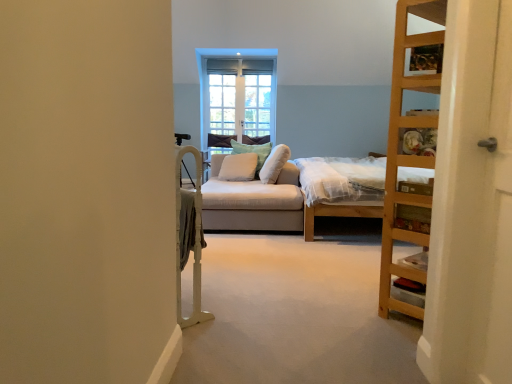
How much space does white soft cushion at center, arranged as the third pillow when viewed from the right, occupy horizontally?

It is 17.47 inches.

This screenshot has width=512, height=384. What do you see at coordinates (472, 203) in the screenshot?
I see `white wood screen door at right` at bounding box center [472, 203].

You are a GUI agent. You are given a task and a screenshot of the screen. Output one action in this format:
    pyautogui.click(x=<x>, y=<y>)
    Task: Click on the light beige fabric couch at center
    
    Given the screenshot: What is the action you would take?
    pyautogui.click(x=255, y=198)

From the picture: Measure the distance between point (388, 291) and camera.

Point (388, 291) is 2.29 meters from camera.

In order to click on light brown wooden bed at right in this screenshot , I will do `click(340, 190)`.

Considering the sizes of objects white soft pillow at center, which is the 3th pillow from left to right, and white wood screen door at right in the image provided, who is bigger, white soft pillow at center, which is the 3th pillow from left to right, or white wood screen door at right?

Bigger between the two is white soft pillow at center, which is the 3th pillow from left to right.

Is white soft pillow at center, which is the first pillow from right to left, situated inside white wood screen door at right or outside?

white soft pillow at center, which is the first pillow from right to left, is spatially situated outside white wood screen door at right.

This screenshot has width=512, height=384. Find the location of `screen door in front of the white soft pillow at center, which is the 3th pillow from left to right`. screen door in front of the white soft pillow at center, which is the 3th pillow from left to right is located at coordinates (472, 203).

From the image's perspective, is white soft pillow at center, which is the first pillow from right to left, above or below white wood screen door at right?

Based on their image positions, white soft pillow at center, which is the first pillow from right to left, is located above white wood screen door at right.

Who is smaller, light brown wooden bed at right or white soft pillow at center, which is the first pillow from right to left?

white soft pillow at center, which is the first pillow from right to left, is smaller.

Which is in front, point (358, 159) or point (273, 155)?

Positioned in front is point (273, 155).

Is the position of light brown wooden bed at right less distant than that of white soft pillow at center, which is the 3th pillow from left to right?

That is True.

This screenshot has height=384, width=512. Find the location of `pillow that is the 3rd one above the light brown wooden bed at right (from a real-world perspective)`. pillow that is the 3rd one above the light brown wooden bed at right (from a real-world perspective) is located at coordinates (274, 164).

Are white soft pillow at center, which ranks as the 2th pillow in right-to-left order, and white wood screen door at right beside each other?

There is a gap between white soft pillow at center, which ranks as the 2th pillow in right-to-left order, and white wood screen door at right.

From the picture: Who is bigger, white soft pillow at center, placed as the 2th pillow when sorted from left to right, or white wood screen door at right?

white soft pillow at center, placed as the 2th pillow when sorted from left to right.

From the image's perspective, who appears lower, white soft pillow at center, which ranks as the 2th pillow in right-to-left order, or white wood screen door at right?

white wood screen door at right appears lower in the image.

Is white soft pillow at center, placed as the 2th pillow when sorted from left to right, wider than white wood screen door at right?

Correct, the width of white soft pillow at center, placed as the 2th pillow when sorted from left to right, exceeds that of white wood screen door at right.

Based on their positions, is white wood screen door at right located to the left or right of white soft pillow at center, which ranks as the 2th pillow in right-to-left order?

Clearly, white wood screen door at right is on the right of white soft pillow at center, which ranks as the 2th pillow in right-to-left order, in the image.

Is white wood screen door at right placed right next to white soft pillow at center, which ranks as the 2th pillow in right-to-left order?

They are not placed beside each other.

Is point (451, 244) more distant than point (259, 154)?

No.

Can you confirm if white wood screen door at right is wider than white soft pillow at center, which ranks as the 2th pillow in right-to-left order?

In fact, white wood screen door at right might be narrower than white soft pillow at center, which ranks as the 2th pillow in right-to-left order.

Which is correct: clear glass window at center is inside white soft pillow at center, placed as the 2th pillow when sorted from left to right, or outside of it?

clear glass window at center is not inside white soft pillow at center, placed as the 2th pillow when sorted from left to right, it's outside.

At what (x,y) coordinates should I click in order to perform the action: click on window above the white soft pillow at center, placed as the 2th pillow when sorted from left to right (from the image's perspective). Please return your answer as a coordinate pair (x, y). This screenshot has height=384, width=512. Looking at the image, I should click on (237, 94).

Considering the sizes of clear glass window at center and white soft pillow at center, which ranks as the 2th pillow in right-to-left order, in the image, is clear glass window at center bigger or smaller than white soft pillow at center, which ranks as the 2th pillow in right-to-left order,?

clear glass window at center is smaller than white soft pillow at center, which ranks as the 2th pillow in right-to-left order.

Is clear glass window at center oriented towards white soft pillow at center, placed as the 2th pillow when sorted from left to right?

Yes.

The image size is (512, 384). What are the coordinates of `screen door below the light beige fabric couch at center (from the image's perspective)` in the screenshot? It's located at 472,203.

Which object is closer to the camera, light beige fabric couch at center or white wood screen door at right?

Positioned in front is white wood screen door at right.

Is light beige fabric couch at center located outside white wood screen door at right?

Yes, light beige fabric couch at center is not within white wood screen door at right.

Based on the photo, does light beige fabric couch at center have a lesser width compared to white wood screen door at right?

Incorrect, the width of light beige fabric couch at center is not less than that of white wood screen door at right.

Can you confirm if white soft pillow at center, which is the 3th pillow from left to right, is wider than white soft cushion at center, arranged as the third pillow when viewed from the right?

Incorrect, the width of white soft pillow at center, which is the 3th pillow from left to right, does not surpass that of white soft cushion at center, arranged as the third pillow when viewed from the right.

Which of these two, white soft pillow at center, which is the 3th pillow from left to right, or white soft cushion at center, arranged as the third pillow when viewed from the right, stands shorter?

white soft pillow at center, which is the 3th pillow from left to right.

Is point (280, 150) closer or farther from the camera than point (255, 160)?

Point (280, 150) is positioned closer to the camera compared to point (255, 160).

Could you tell me if white soft pillow at center, which is the 3th pillow from left to right, is turned towards white soft cushion at center, marked as the 1th pillow in a left-to-right arrangement?

Yes, white soft pillow at center, which is the 3th pillow from left to right, faces towards white soft cushion at center, marked as the 1th pillow in a left-to-right arrangement.

Where is `screen door that is in front of the white soft pillow at center, which is the 3th pillow from left to right`? The height and width of the screenshot is (384, 512). screen door that is in front of the white soft pillow at center, which is the 3th pillow from left to right is located at coordinates (472, 203).

This screenshot has height=384, width=512. What are the coordinates of `the 1st pillow counting from the left side of the light brown wooden bed at right` in the screenshot? It's located at (274, 164).

Considering their positions, is white soft pillow at center, placed as the 2th pillow when sorted from left to right, positioned closer to white soft pillow at center, which is the 3th pillow from left to right, than clear glass window at center?

white soft pillow at center, placed as the 2th pillow when sorted from left to right, is positioned closer to the anchor white soft pillow at center, which is the 3th pillow from left to right.

Based on their spatial positions, is white soft pillow at center, placed as the 2th pillow when sorted from left to right, or clear glass window at center further from white soft cushion at center, marked as the 1th pillow in a left-to-right arrangement?

The object further to white soft cushion at center, marked as the 1th pillow in a left-to-right arrangement, is clear glass window at center.

Estimate the real-world distances between objects in this image. Which object is further from light brown wooden bed at right, white soft pillow at center, which is the 3th pillow from left to right, or white wood screen door at right?

The object further to light brown wooden bed at right is white wood screen door at right.

Estimate the real-world distances between objects in this image. Which object is closer to white soft cushion at center, marked as the 1th pillow in a left-to-right arrangement, light brown wooden bed at right or light beige fabric couch at center?

light beige fabric couch at center lies closer to white soft cushion at center, marked as the 1th pillow in a left-to-right arrangement, than the other object.

Looking at the image, which one is located closer to wooden ladder at right, white soft pillow at center, which is the 3th pillow from left to right, or white soft pillow at center, which ranks as the 2th pillow in right-to-left order?

white soft pillow at center, which is the 3th pillow from left to right, is closer to wooden ladder at right.

Looking at the image, which one is located closer to white soft cushion at center, marked as the 1th pillow in a left-to-right arrangement, white soft pillow at center, which is the 3th pillow from left to right, or white soft pillow at center, which ranks as the 2th pillow in right-to-left order?

white soft pillow at center, which is the 3th pillow from left to right, lies closer to white soft cushion at center, marked as the 1th pillow in a left-to-right arrangement, than the other object.

From the image, which object appears to be farther from clear glass window at center, light brown wooden bed at right or white soft pillow at center, placed as the 2th pillow when sorted from left to right?

Based on the image, light brown wooden bed at right appears to be further to clear glass window at center.

Looking at the image, which one is located further to wooden ladder at right, light brown wooden bed at right or light beige fabric couch at center?

light beige fabric couch at center is further to wooden ladder at right.

I want to click on studio couch between wooden ladder at right and white soft cushion at center, arranged as the third pillow when viewed from the right, from front to back, so click(255, 198).

Where is `bed located between white wood screen door at right and light beige fabric couch at center in the depth direction`? This screenshot has width=512, height=384. bed located between white wood screen door at right and light beige fabric couch at center in the depth direction is located at coordinates (340, 190).

Find the location of `shelf located between white wood screen door at right and white soft cushion at center, arranged as the third pillow when viewed from the right, in the depth direction`. shelf located between white wood screen door at right and white soft cushion at center, arranged as the third pillow when viewed from the right, in the depth direction is located at coordinates (408, 153).

Locate an element on the screen. Image resolution: width=512 pixels, height=384 pixels. bed between white wood screen door at right and white soft cushion at center, arranged as the third pillow when viewed from the right, in the front-back direction is located at coordinates (340, 190).